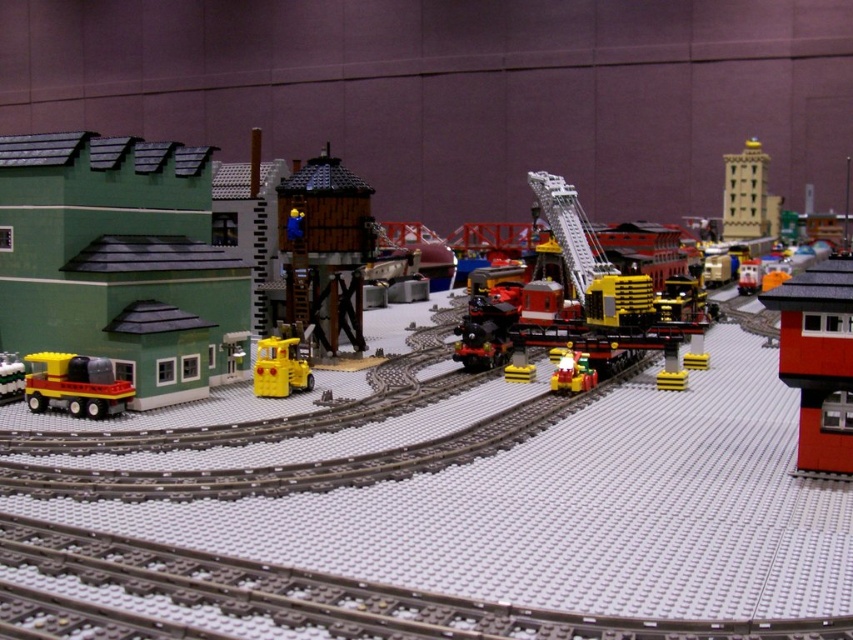
You are a small toy car trying to reach the point marked at coordinate (280, 368) in the Lego train set. The only path available is through the matte yellow truck at center. Can you pass through the truck to reach the point?

The point (280, 368) is on the matte yellow truck at center, so you cannot pass through the truck to reach the point because the point is already located on the truck itself.

In the scene shown: You are a toy train operator who needs to determine the tallest structure in the Lego layout to ensure safe passage. Which object between the matte green building at left and the smooth red brick building at right is taller?

The matte green building at left is taller than the smooth red brick building at right, so it is the tallest structure in the Lego layout.

You are a model train engineer who needs to ensure that your new toy helicopter can fly over all structures in the Lego layout. The helicopter has a minimum required clearance of 2 meters to safely pass over any structure. Given the wooden tower at center and the smooth red brick building at right, can you confirm if the helicopter will have enough clearance over both structures?

The wooden tower at center is much taller than the smooth red brick building at right. Since the helicopter requires a minimum clearance of 2 meters, you need to ensure the wooden tower at center is less than 2 meters tall. However, without specific height measurements, it is impossible to confirm if the helicopter will have enough clearance over both structures.